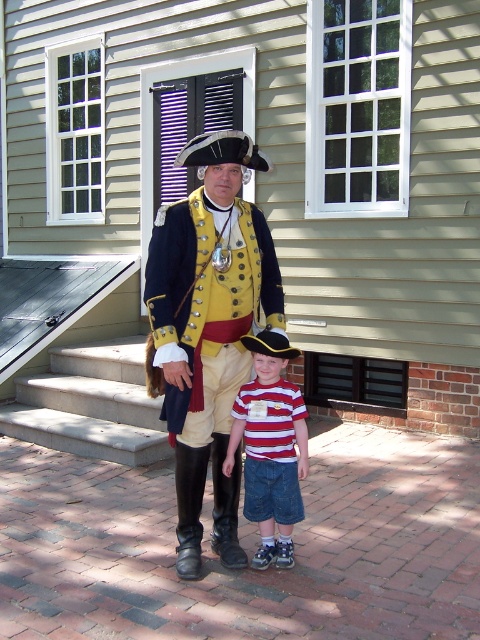
You are a photographer positioned at the entrance of the building. You want to take a photo that includes both the matte gold uniform at center and the concrete stairs at center. Based on their positions, which object should appear closer to the left side of the photo?

The concrete stairs at center should appear closer to the left side of the photo because the matte gold uniform at center is positioned to the right of the concrete stairs at center.

You are a photographer positioned at the entrance of the building. You want to take a photo that includes both the concrete stairs at center and the striped cotton shirt at center. Which object should you adjust your camera angle to focus on first to ensure both are in frame?

The concrete stairs at center is further to the viewer than the striped cotton shirt at center, so you should focus on the striped cotton shirt at center first to ensure both are in frame.